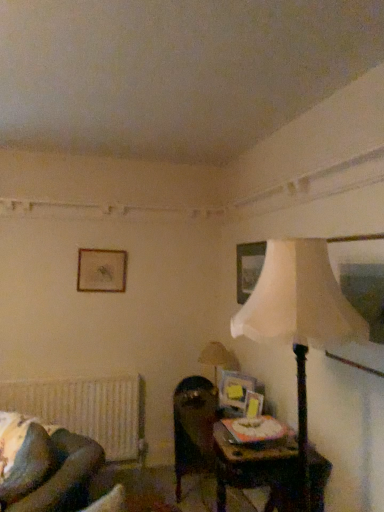
Question: From the image's perspective, relative to wooden picture frame at center, arranged as the second picture frame when viewed from the right, is white textured radiator at lower left above or below?

Choices:
 (A) above
 (B) below

Answer: (B)

Question: Is white textured radiator at lower left wider or thinner than wooden picture frame at center, acting as the fourth picture frame starting from the top?

Choices:
 (A) thin
 (B) wide

Answer: (B)

Question: Estimate the real-world distances between objects in this image. Which object is closer to the dark brown leather rocking chair at lower left?

Choices:
 (A) matte gold picture frame at upper center, which is the 1th picture frame from back to front
 (B) dark brown leather swivel chair at center
 (C) white textured radiator at lower left
 (D) white fabric lampshade at right, which appears as the 2th lamp when viewed from the back
 (E) wooden picture frame at upper center, positioned as the third picture frame in front-to-back order

Answer: (B)

Question: Which object is positioned farthest from the white fabric lampshade at right, the 1th lamp from the front?

Choices:
 (A) dark brown leather rocking chair at lower left
 (B) matte beige lampshade at right, the 1th lamp positioned from the back
 (C) wooden picture frame at upper center, which is counted as the first picture frame, starting from the right
 (D) matte wooden picture frame at center-right, which ranks as the 3th picture frame in back-to-front order
 (E) wooden table at lower right

Answer: (B)